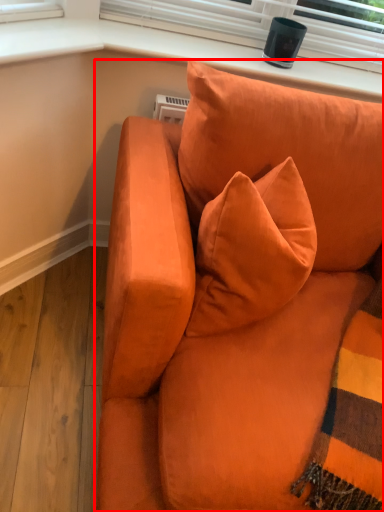
Question: Where is studio couch (annotated by the red box) located in relation to window sill in the image?

Choices:
 (A) left
 (B) right

Answer: (B)